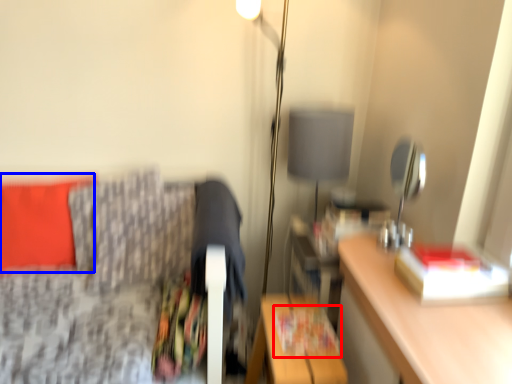
Question: Which of the following is the farthest to the observer, magazine (highlighted by a red box) or pillow (highlighted by a blue box)?

Choices:
 (A) magazine
 (B) pillow

Answer: (B)